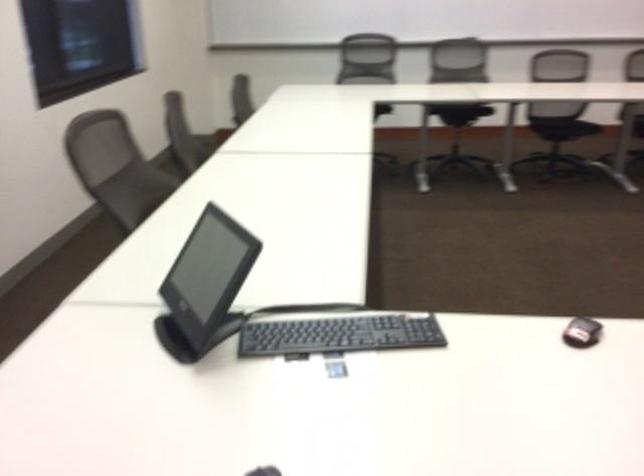
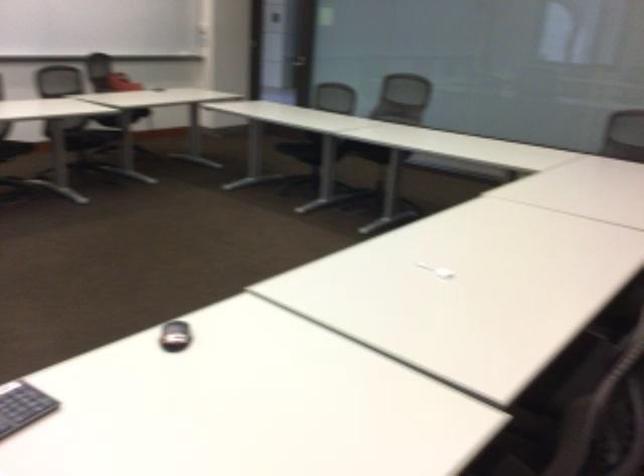
The images are taken continuously from a first-person perspective. In which direction is your viewpoint rotating?

The camera rotated toward right-down.